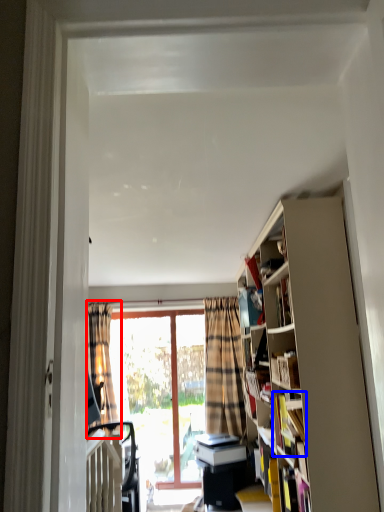
Question: Among these objects, which one is nearest to the camera, curtain (highlighted by a red box) or book (highlighted by a blue box)?

Choices:
 (A) curtain
 (B) book

Answer: (B)